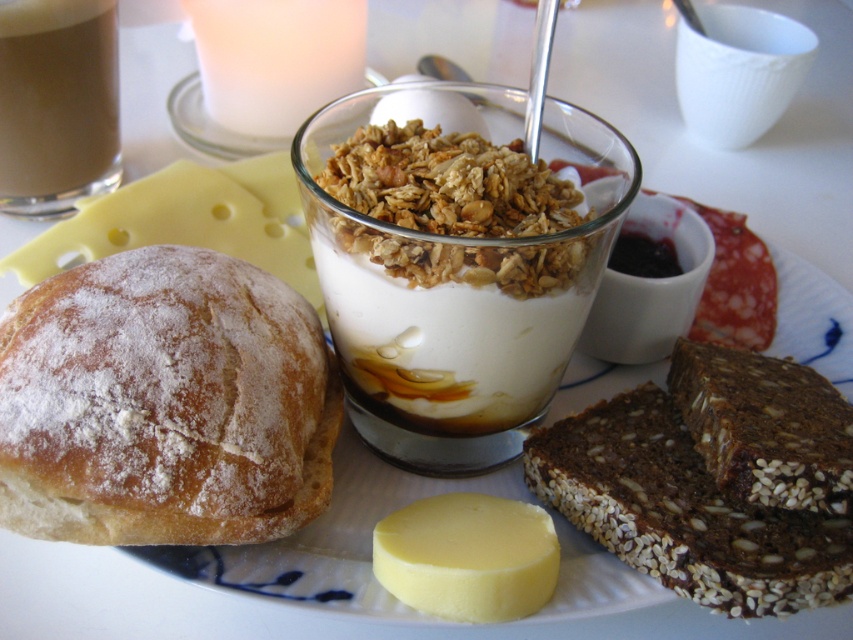
You are arranging a breakfast plate and want to place the brown seeded bread at lower right and the yellow creamy cheese at center. Which one has a larger width?

The brown seeded bread at lower right has a larger width than the yellow creamy cheese at center according to the description.

You are looking at the breakfast plate and notice two points marked on it. The first point is at coordinates point (779,435) and the second is at point (20,161). Which of these points is closer to you?

Point (779,435) is closer to the viewer than point (20,161).

You are a chef preparing a meal and need to pour the smooth brown liquid at upper left into a container placed 20 inches away. Can you reach it without moving your position?

The smooth brown liquid at upper left is 21.02 inches away from the container, so you cannot reach it without moving since it is slightly farther than 20 inches.